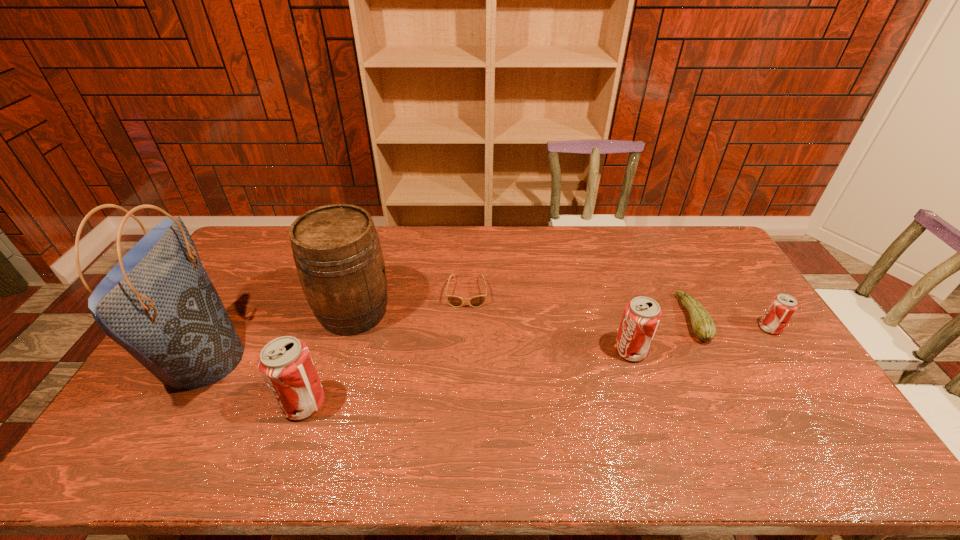
Where is `the tallest object`? the tallest object is located at coordinates (158, 303).

At what (x,y) coordinates should I click in order to perform the action: click on the leftmost object. Please return your answer as a coordinate pair (x, y). This screenshot has height=540, width=960. Looking at the image, I should click on (158, 303).

The image size is (960, 540). I want to click on vacant space located 0.140m on the left of the nearest soda can, so click(x=229, y=403).

The width and height of the screenshot is (960, 540). I want to click on free point located 0.400m on the right of the second shortest soda can, so coord(782,350).

Identify the location of vacant space positioned 0.060m on the left of the farthest soda can. (740, 328).

Where is `blank space located 0.170m on the front-facing side of the fourth object from right to left`? blank space located 0.170m on the front-facing side of the fourth object from right to left is located at coordinates (465, 349).

Find the location of a particular element. Image resolution: width=960 pixels, height=540 pixels. free space located at the stem end of the sixth object from left to right is located at coordinates (623, 319).

This screenshot has height=540, width=960. I want to click on free space located 0.130m at the stem end of the sixth object from left to right, so click(642, 319).

Where is `vacant point located 0.300m at the stem end of the sixth object from left to right`? Image resolution: width=960 pixels, height=540 pixels. vacant point located 0.300m at the stem end of the sixth object from left to right is located at coordinates (588, 319).

Locate an element on the screen. Image resolution: width=960 pixels, height=540 pixels. free space located 0.070m on the side of the second tallest object near the bung hole is located at coordinates (415, 312).